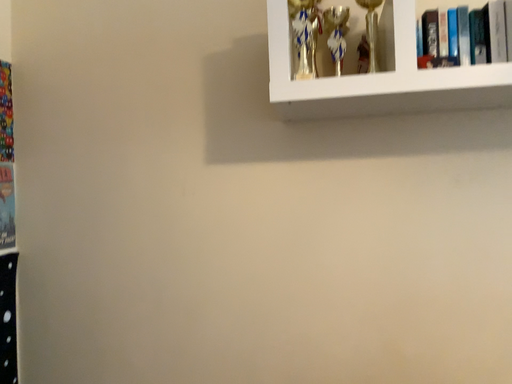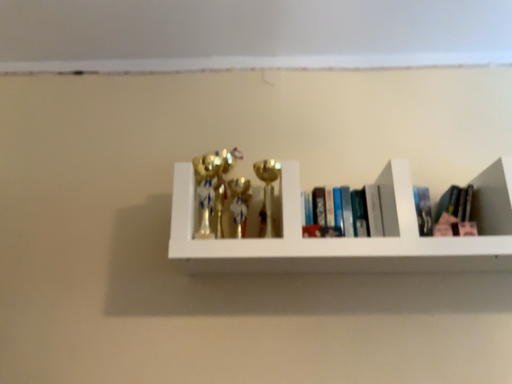
Question: Which way did the camera rotate in the video?

Choices:
 (A) rotated left
 (B) rotated right

Answer: (B)